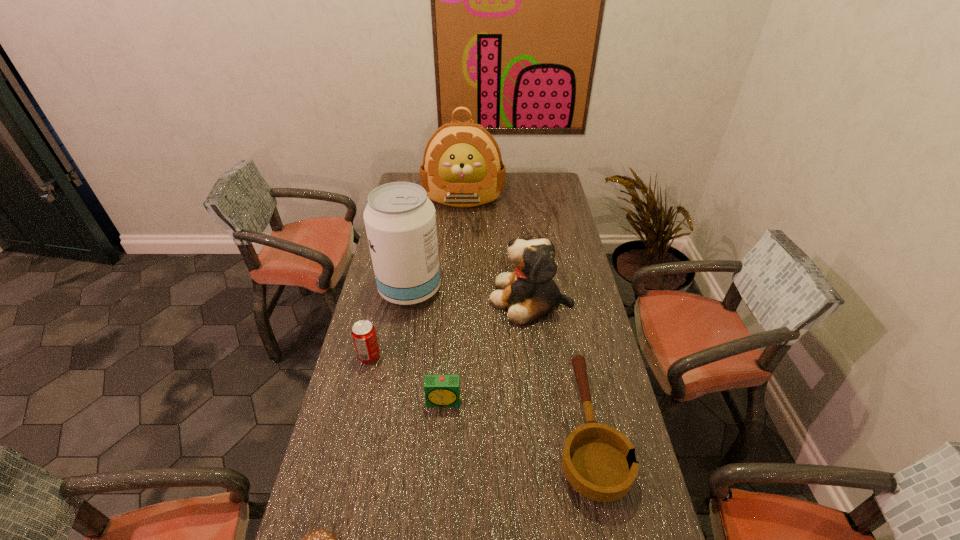
In order to click on free space between the fifth shortest object and the backpack in this screenshot , I will do `click(497, 248)`.

Locate an element on the screen. The height and width of the screenshot is (540, 960). free spot between the fourth farthest object and the puppy is located at coordinates click(450, 328).

At what (x,y) coordinates should I click in order to perform the action: click on object that stands as the fourth closest to the alcohol. Please return your answer as a coordinate pair (x, y). Image resolution: width=960 pixels, height=540 pixels. Looking at the image, I should click on (462, 166).

Locate an element on the screen. The width and height of the screenshot is (960, 540). the closest object to the farthest object is located at coordinates (400, 220).